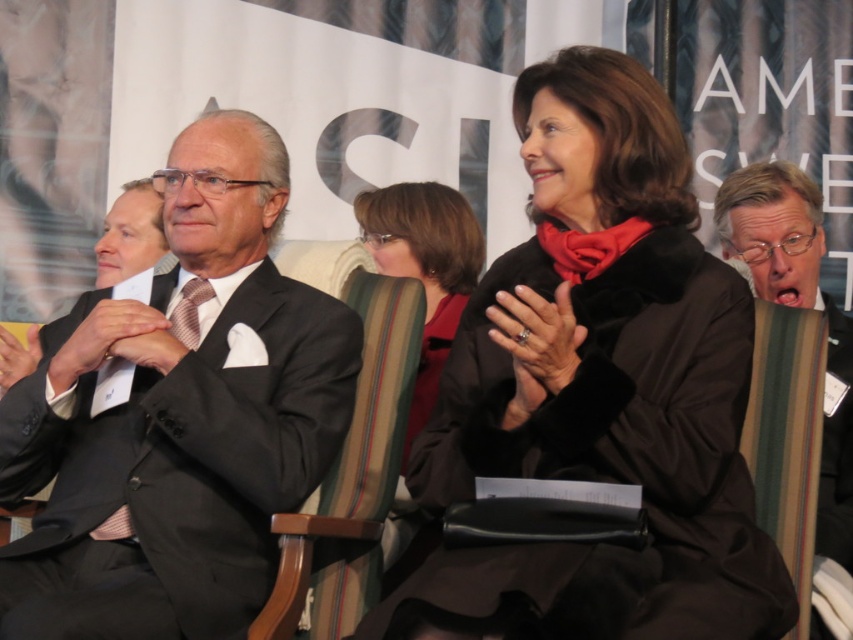
Is velvet black coat at center taller than matte red coat at center?

Yes, velvet black coat at center is taller than matte red coat at center.

Locate an element on the screen. The width and height of the screenshot is (853, 640). velvet black coat at center is located at coordinates (599, 388).

This screenshot has width=853, height=640. Describe the element at coordinates (599, 388) in the screenshot. I see `velvet black coat at center` at that location.

What are the coordinates of `velvet black coat at center` in the screenshot? It's located at (599, 388).

Find the location of `velvet black coat at center`. velvet black coat at center is located at coordinates tap(599, 388).

In the scene shown: Does matte black suit at left have a lesser width compared to matte red coat at center?

In fact, matte black suit at left might be wider than matte red coat at center.

The height and width of the screenshot is (640, 853). Describe the element at coordinates (177, 417) in the screenshot. I see `matte black suit at left` at that location.

Where is `matte black suit at left`? matte black suit at left is located at coordinates (177, 417).